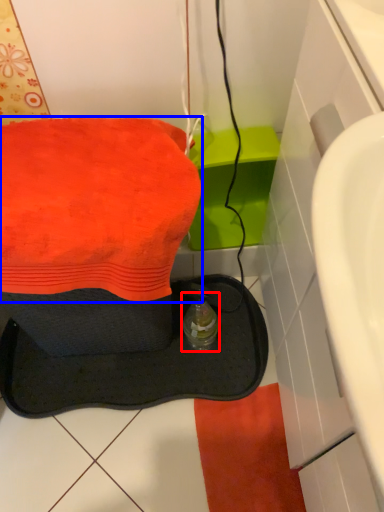
Question: Which point is further to the camera, bottle (highlighted by a red box) or towel (highlighted by a blue box)?

Choices:
 (A) bottle
 (B) towel

Answer: (A)